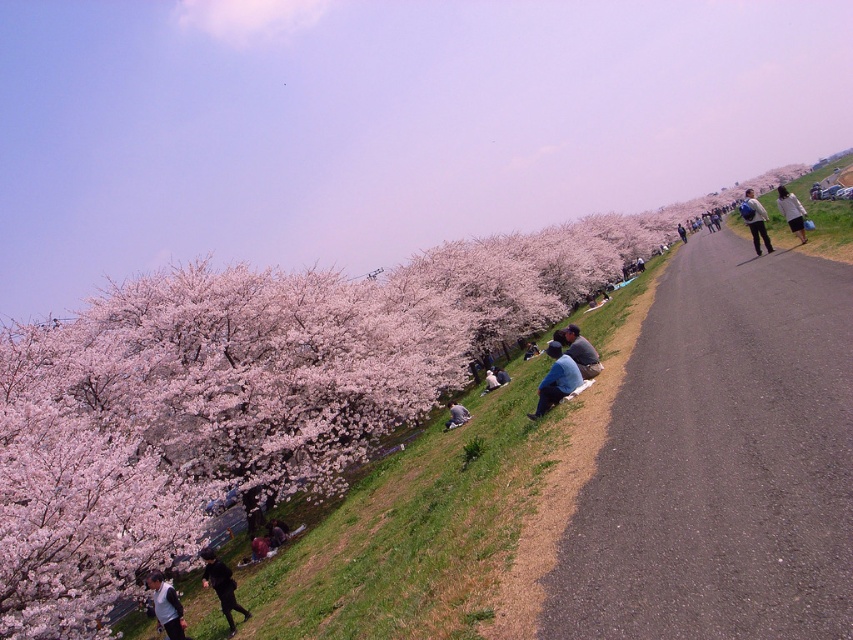
Can you confirm if asphalt road at center is positioned to the left of black matte jacket at lower left?

In fact, asphalt road at center is to the right of black matte jacket at lower left.

Who is more distant from viewer, (566, 554) or (230, 586)?

Point (230, 586)

Who is more distant from viewer, (798, 573) or (231, 630)?

Positioned behind is point (231, 630).

Find the location of `asphalt road at center`. asphalt road at center is located at coordinates (721, 461).

How far apart are light blue denim jacket at right and light blue denim jeans at center?

light blue denim jacket at right is 14.59 meters away from light blue denim jeans at center.

Does point (749, 188) come farther from viewer compared to point (450, 412)?

Yes, it is.

In order to click on light blue denim jacket at right in this screenshot , I will do `click(755, 220)`.

Is the position of denim jeans at center less distant than that of dark gray fabric jacket at lower center?

Yes, denim jeans at center is in front of dark gray fabric jacket at lower center.

Is denim jeans at center bigger than dark gray fabric jacket at lower center?

Yes, denim jeans at center is bigger than dark gray fabric jacket at lower center.

Is point (595, 356) positioned behind point (274, 524)?

No, (595, 356) is in front of (274, 524).

At what (x,y) coordinates should I click in order to perform the action: click on denim jeans at center. Please return your answer as a coordinate pair (x, y). The width and height of the screenshot is (853, 640). Looking at the image, I should click on (579, 352).